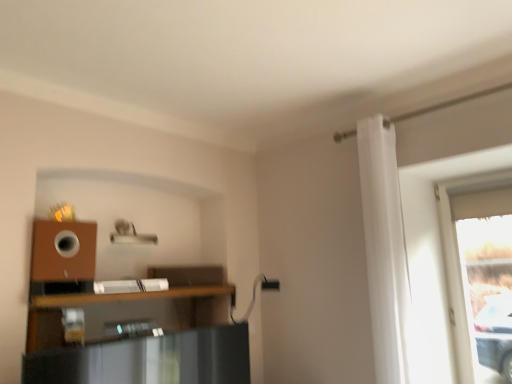
Question: Could you tell me if transparent glass window at right is turned towards white fabric curtain at right?

Choices:
 (A) no
 (B) yes

Answer: (B)

Question: Considering the relative sizes of transparent glass window at right and white fabric curtain at right in the image provided, is transparent glass window at right shorter than white fabric curtain at right?

Choices:
 (A) yes
 (B) no

Answer: (A)

Question: Are transparent glass window at right and white fabric curtain at right located far from each other?

Choices:
 (A) no
 (B) yes

Answer: (A)

Question: Is transparent glass window at right at the right side of white fabric curtain at right?

Choices:
 (A) yes
 (B) no

Answer: (A)

Question: Is the surface of transparent glass window at right in direct contact with white fabric curtain at right?

Choices:
 (A) no
 (B) yes

Answer: (A)

Question: In terms of size, does brown wooden shelf at lower left appear bigger or smaller than white fabric curtain at right?

Choices:
 (A) small
 (B) big

Answer: (A)

Question: From the image's perspective, is brown wooden shelf at lower left positioned above or below white fabric curtain at right?

Choices:
 (A) below
 (B) above

Answer: (A)

Question: In the image, is brown wooden shelf at lower left positioned in front of or behind white fabric curtain at right?

Choices:
 (A) front
 (B) behind

Answer: (A)

Question: Would you say brown wooden shelf at lower left is inside or outside white fabric curtain at right?

Choices:
 (A) inside
 (B) outside

Answer: (B)

Question: Is transparent glass window at right to the left or to the right of brown wooden shelf at lower left in the image?

Choices:
 (A) right
 (B) left

Answer: (A)

Question: Considering the positions of transparent glass window at right and brown wooden shelf at lower left in the image, is transparent glass window at right bigger or smaller than brown wooden shelf at lower left?

Choices:
 (A) small
 (B) big

Answer: (B)

Question: From a real-world perspective, is transparent glass window at right above or below brown wooden shelf at lower left?

Choices:
 (A) above
 (B) below

Answer: (A)

Question: Does point (448, 236) appear closer or farther from the camera than point (53, 301)?

Choices:
 (A) farther
 (B) closer

Answer: (A)

Question: Considering the positions of brown wooden shelf at lower left and transparent glass window at right in the image, is brown wooden shelf at lower left wider or thinner than transparent glass window at right?

Choices:
 (A) thin
 (B) wide

Answer: (B)

Question: From the image's perspective, is brown wooden shelf at lower left located above or below transparent glass window at right?

Choices:
 (A) below
 (B) above

Answer: (A)